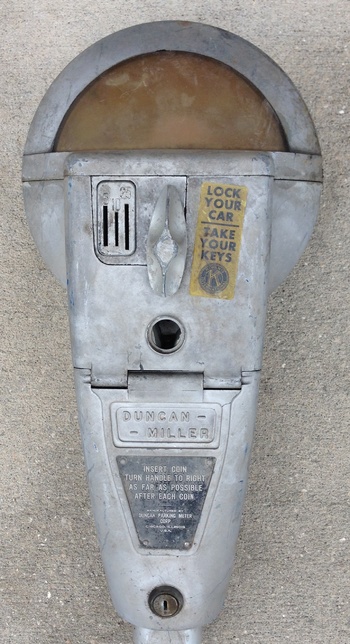
Identify the location of key hole. (165, 603).